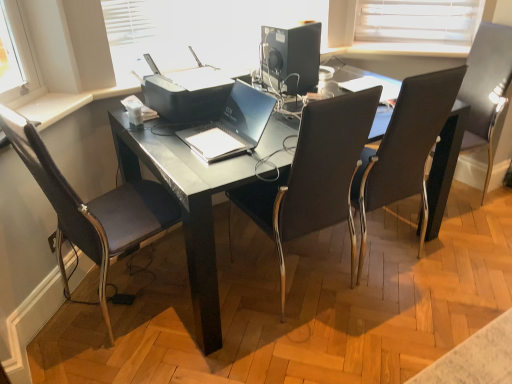
Question: Can you confirm if dark brown leather chair at left, the 4th chair positioned from the right, is positioned to the right of black plastic printer at center?

Choices:
 (A) yes
 (B) no

Answer: (B)

Question: Is dark brown leather chair at left, positioned as the 1th chair in left-to-right order, smaller than black plastic printer at center?

Choices:
 (A) yes
 (B) no

Answer: (B)

Question: Is dark brown leather chair at left, the 4th chair positioned from the right, positioned behind black plastic printer at center?

Choices:
 (A) yes
 (B) no

Answer: (B)

Question: Is dark brown leather chair at left, the 4th chair positioned from the right, aimed at black plastic printer at center?

Choices:
 (A) yes
 (B) no

Answer: (A)

Question: Considering the relative sizes of dark brown leather chair at left, positioned as the 1th chair in left-to-right order, and black plastic printer at center in the image provided, is dark brown leather chair at left, positioned as the 1th chair in left-to-right order, bigger than black plastic printer at center?

Choices:
 (A) yes
 (B) no

Answer: (A)

Question: Is dark brown leather chair at left, positioned as the 1th chair in left-to-right order, wider than black plastic printer at center?

Choices:
 (A) yes
 (B) no

Answer: (A)

Question: Considering the relative sizes of matte plastic printer at upper center and black leather chair at upper right, acting as the 4th chair starting from the left, in the image provided, is matte plastic printer at upper center wider than black leather chair at upper right, acting as the 4th chair starting from the left,?

Choices:
 (A) yes
 (B) no

Answer: (B)

Question: Would you say matte plastic printer at upper center is outside black leather chair at upper right, which is counted as the 1th chair, starting from the right?

Choices:
 (A) no
 (B) yes

Answer: (B)

Question: Considering the relative sizes of matte plastic printer at upper center and black leather chair at upper right, which is counted as the 1th chair, starting from the right, in the image provided, is matte plastic printer at upper center shorter than black leather chair at upper right, which is counted as the 1th chair, starting from the right,?

Choices:
 (A) no
 (B) yes

Answer: (B)

Question: From a real-world perspective, is matte plastic printer at upper center on top of black leather chair at upper right, which is counted as the 1th chair, starting from the right?

Choices:
 (A) yes
 (B) no

Answer: (A)

Question: Is matte plastic printer at upper center at the left side of black leather chair at upper right, which is counted as the 1th chair, starting from the right?

Choices:
 (A) no
 (B) yes

Answer: (B)

Question: Can you confirm if matte plastic printer at upper center is thinner than black leather chair at upper right, acting as the 4th chair starting from the left?

Choices:
 (A) yes
 (B) no

Answer: (A)

Question: From a real-world perspective, is satin black laptop at center physically above black plastic desktop computer at upper center?

Choices:
 (A) no
 (B) yes

Answer: (A)